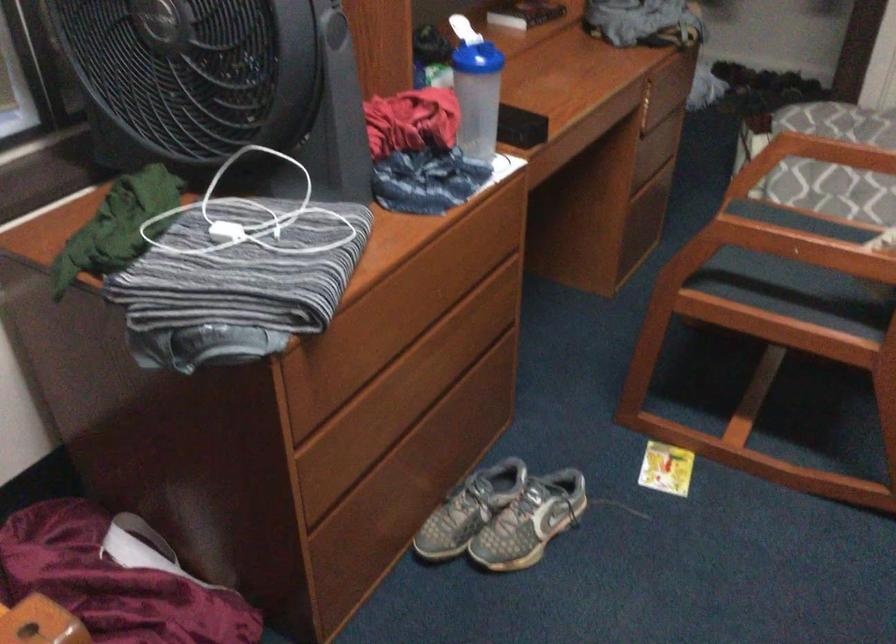
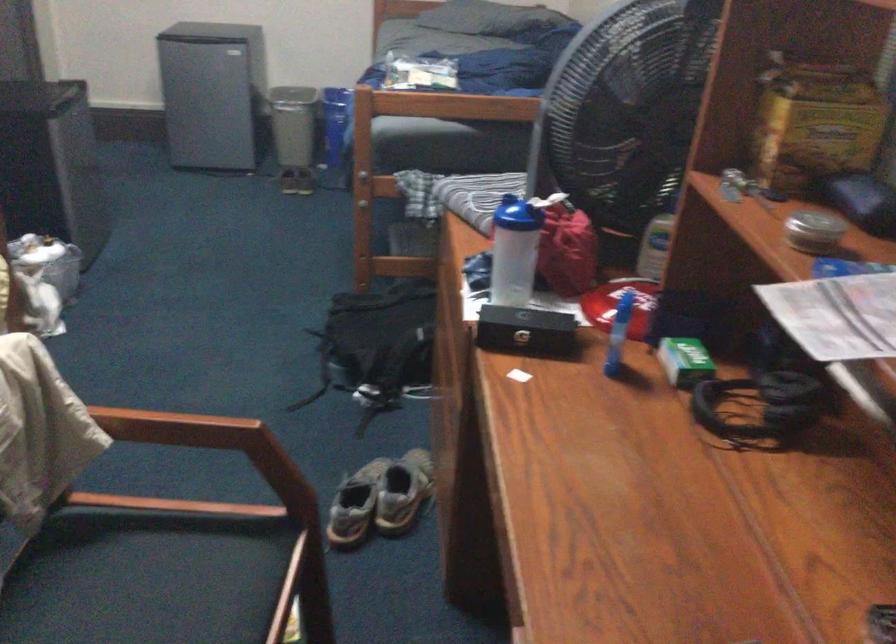
The point at (x=486, y=507) is marked in the first image. Where is the corresponding point in the second image?

(402, 491)